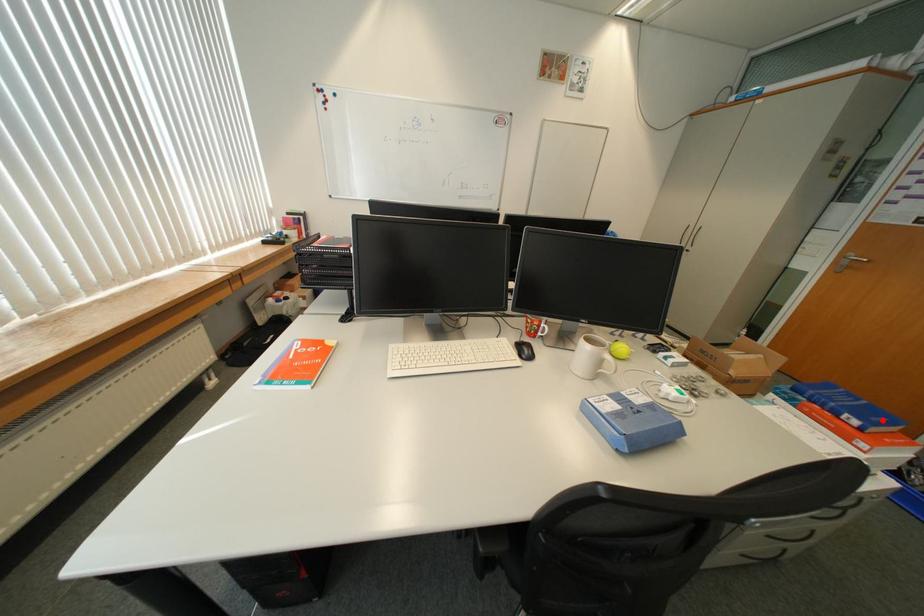
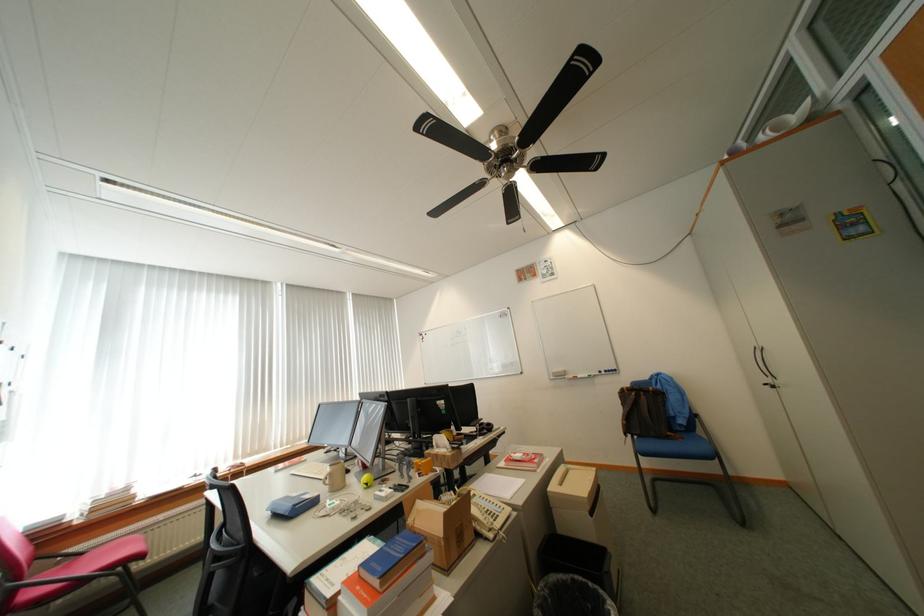
Find the pixel in the second image that matches the highlighted location in the first image.

(383, 565)